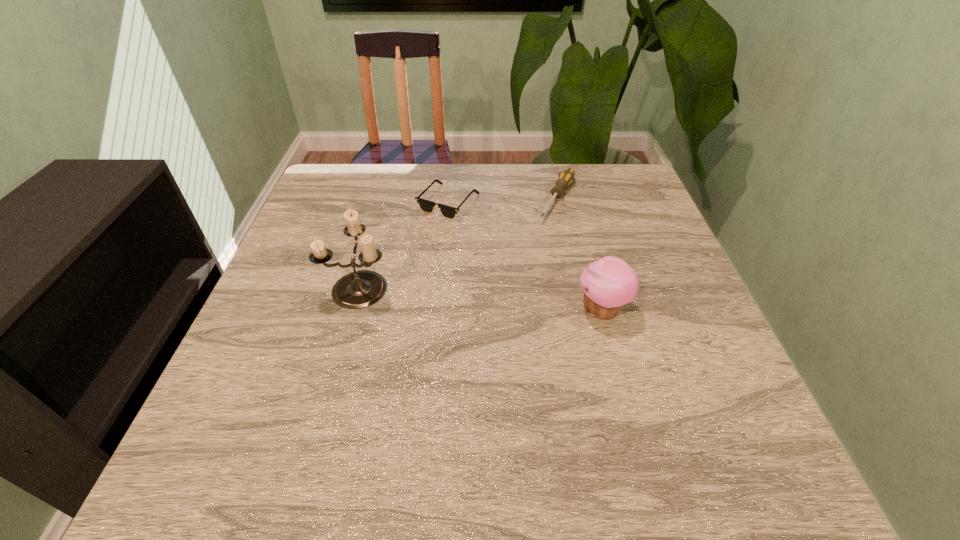
Identify the location of free spot between the tallest object and the screwdriver. (459, 242).

Where is `unoccupied position between the tallest object and the sunglasses`? The image size is (960, 540). unoccupied position between the tallest object and the sunglasses is located at coordinates (404, 244).

Where is `free space that is in between the shortest object and the cupcake`? free space that is in between the shortest object and the cupcake is located at coordinates (525, 256).

I want to click on vacant space that's between the screwdriver and the third shortest object, so click(580, 254).

I want to click on the third closest object to the screwdriver, so click(359, 289).

Choose which object is the nearest neighbor to the sunglasses. Please provide its 2D coordinates. Your answer should be formatted as a tuple, i.e. [(x, y)], where the tuple contains the x and y coordinates of a point satisfying the conditions above.

[(565, 178)]

Identify the location of free space that satisfies the following two spatial constraints: 1. on the back side of the candle holder; 2. on the right side of the third object from right to left. pyautogui.click(x=383, y=202).

In order to click on free space that satisfies the following two spatial constraints: 1. on the back side of the candle holder; 2. on the left side of the second shortest object in this screenshot , I will do [384, 199].

You are a GUI agent. You are given a task and a screenshot of the screen. Output one action in this format:
    pyautogui.click(x=<x>, y=<y>)
    Task: Click on the vacant space that satisfies the following two spatial constraints: 1. on the back side of the tallest object; 2. on the right side of the shortest object
    The height and width of the screenshot is (540, 960).
    Given the screenshot: What is the action you would take?
    pyautogui.click(x=383, y=202)

Image resolution: width=960 pixels, height=540 pixels. I want to click on blank space that satisfies the following two spatial constraints: 1. on the back side of the candle holder; 2. on the left side of the screwdriver, so click(384, 199).